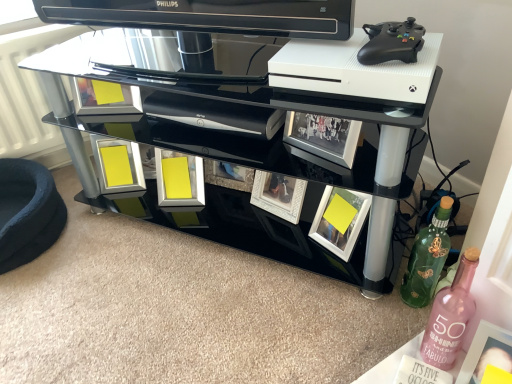
This screenshot has width=512, height=384. What are the coordinates of `pink glass bottle at lower right, the 1th bottle when ordered from front to back` in the screenshot? It's located at (450, 315).

At what (x,y) coordinates should I click in order to perform the action: click on metallic yellow picture frame at lower left, which ranks as the 1th picture frame in back-to-front order. Please return your answer as a coordinate pair (x, y). The width and height of the screenshot is (512, 384). Looking at the image, I should click on (118, 165).

In order to face yellow matte picture frame at lower right, marked as the 1th picture frame in a right-to-left arrangement, should I rotate leftwards or rightwards?

You should rotate right by 30.570 degrees.

Image resolution: width=512 pixels, height=384 pixels. Describe the element at coordinates (426, 257) in the screenshot. I see `green matte bottle at lower right, acting as the second bottle starting from the front` at that location.

What is the approximate height of green matte bottle at lower right, the first bottle viewed from the back?

green matte bottle at lower right, the first bottle viewed from the back, is 12.45 inches tall.

What is the approximate height of velvet cushion at lower left?

velvet cushion at lower left is 7.46 inches tall.

Locate an element on the screen. black glass tv stand at center is located at coordinates (277, 107).

Measure the distance between point (412, 372) and camera.

Point (412, 372) and camera are 84.80 centimeters apart.

Where is `pink glass bottle at lower right, which is counted as the second bottle, starting from the back`? pink glass bottle at lower right, which is counted as the second bottle, starting from the back is located at coordinates (450, 315).

Is point (439, 48) positioned after point (132, 154)?

No, (439, 48) is in front of (132, 154).

Could you tell me if black glass tv stand at center is turned towards metallic yellow picture frame at lower left, which appears as the 5th picture frame when viewed from the front?

Yes, black glass tv stand at center is aimed at metallic yellow picture frame at lower left, which appears as the 5th picture frame when viewed from the front.

Considering the sizes of black glass tv stand at center and metallic yellow picture frame at lower left, which ranks as the 1th picture frame in back-to-front order, in the image, is black glass tv stand at center taller or shorter than metallic yellow picture frame at lower left, which ranks as the 1th picture frame in back-to-front order,?

In the image, black glass tv stand at center appears to be taller than metallic yellow picture frame at lower left, which ranks as the 1th picture frame in back-to-front order.

In terms of height, does white glossy magazine at lower right look taller or shorter compared to metallic silver picture frame at center, the second picture frame in the left-to-right sequence?

Considering their sizes, white glossy magazine at lower right has less height than metallic silver picture frame at center, the second picture frame in the left-to-right sequence.

Is white glossy magazine at lower right at the left side of metallic silver picture frame at center, positioned as the third picture frame in front-to-back order?

No, white glossy magazine at lower right is not to the left of metallic silver picture frame at center, positioned as the third picture frame in front-to-back order.

From a real-world perspective, between white glossy magazine at lower right and metallic silver picture frame at center, the second picture frame in the left-to-right sequence, who is vertically higher?

From a 3D spatial view, metallic silver picture frame at center, the second picture frame in the left-to-right sequence, is above.

Is white glossy magazine at lower right aimed at metallic silver picture frame at center, which is counted as the third picture frame, starting from the back?

No, white glossy magazine at lower right is not facing towards metallic silver picture frame at center, which is counted as the third picture frame, starting from the back.

From the image's perspective, relative to metallic yellow picture frame at lower left, positioned as the 1th picture frame in left-to-right order, is green matte bottle at lower right, acting as the second bottle starting from the front, above or below?

Answer: Based on their image positions, green matte bottle at lower right, acting as the second bottle starting from the front, is located beneath metallic yellow picture frame at lower left, positioned as the 1th picture frame in left-to-right order.

Is point (418, 303) less distant than point (93, 150)?

Yes, point (418, 303) is closer to viewer.

How much distance is there between green matte bottle at lower right, acting as the second bottle starting from the front, and metallic yellow picture frame at lower left, which is counted as the 5th picture frame, starting from the right?

green matte bottle at lower right, acting as the second bottle starting from the front, and metallic yellow picture frame at lower left, which is counted as the 5th picture frame, starting from the right, are 35.11 inches apart from each other.

From a real-world perspective, relative to metallic yellow picture frame at lower left, which appears as the 5th picture frame when viewed from the front, is green matte bottle at lower right, the first bottle viewed from the back, vertically above or below?

green matte bottle at lower right, the first bottle viewed from the back, is situated higher than metallic yellow picture frame at lower left, which appears as the 5th picture frame when viewed from the front, in the real world.

Based on the photo, considering the sizes of matte yellow picture frame at lower center, acting as the 3th picture frame starting from the left, and green matte bottle at lower right, the first bottle viewed from the back, in the image, is matte yellow picture frame at lower center, acting as the 3th picture frame starting from the left, taller or shorter than green matte bottle at lower right, the first bottle viewed from the back,?

matte yellow picture frame at lower center, acting as the 3th picture frame starting from the left, is shorter than green matte bottle at lower right, the first bottle viewed from the back.

From the image's perspective, is matte yellow picture frame at lower center, positioned as the 2th picture frame in back-to-front order, positioned above or below green matte bottle at lower right, the first bottle viewed from the back?

From the image's perspective, matte yellow picture frame at lower center, positioned as the 2th picture frame in back-to-front order, appears above green matte bottle at lower right, the first bottle viewed from the back.

Is matte yellow picture frame at lower center, acting as the 3th picture frame starting from the right, oriented away from green matte bottle at lower right, the first bottle viewed from the back?

No, matte yellow picture frame at lower center, acting as the 3th picture frame starting from the right, is not facing away from green matte bottle at lower right, the first bottle viewed from the back.

Considering the positions of point (193, 171) and point (472, 250), is point (193, 171) closer or farther from the camera than point (472, 250)?

Point (193, 171).

Is the position of matte yellow picture frame at lower center, acting as the 3th picture frame starting from the right, more distant than that of pink glass bottle at lower right, which is counted as the second bottle, starting from the back?

Yes, the depth of matte yellow picture frame at lower center, acting as the 3th picture frame starting from the right, is greater than that of pink glass bottle at lower right, which is counted as the second bottle, starting from the back.

Is the surface of matte yellow picture frame at lower center, positioned as the 2th picture frame in back-to-front order, in direct contact with pink glass bottle at lower right, the 1th bottle when ordered from front to back?

No.

Consider the image. Is matte yellow picture frame at lower center, acting as the 3th picture frame starting from the right, facing away from black glass tv stand at center?

Absolutely, matte yellow picture frame at lower center, acting as the 3th picture frame starting from the right, is directed away from black glass tv stand at center.

Does matte yellow picture frame at lower center, positioned as the 2th picture frame in back-to-front order, have a smaller size compared to black glass tv stand at center?

Yes.

Which is behind, matte yellow picture frame at lower center, the 4th picture frame positioned from the front, or black glass tv stand at center?

matte yellow picture frame at lower center, the 4th picture frame positioned from the front, is more distant.

Is matte yellow picture frame at lower center, the 4th picture frame positioned from the front, spatially inside black glass tv stand at center, or outside of it?

matte yellow picture frame at lower center, the 4th picture frame positioned from the front, fits inside black glass tv stand at center.

How different are the orientations of black glass tv stand at center and matte yellow picture frame at lower center, positioned as the 2th picture frame in back-to-front order, in degrees?

22.7 degrees.

From a real-world perspective, does black glass tv stand at center sit lower than matte yellow picture frame at lower center, acting as the 3th picture frame starting from the right?

No, from a real-world perspective, black glass tv stand at center is not beneath matte yellow picture frame at lower center, acting as the 3th picture frame starting from the right.

In terms of width, does black glass tv stand at center look wider or thinner when compared to matte yellow picture frame at lower center, positioned as the 2th picture frame in back-to-front order?

Considering their sizes, black glass tv stand at center looks broader than matte yellow picture frame at lower center, positioned as the 2th picture frame in back-to-front order.

From the image's perspective, between black glass tv stand at center and matte yellow picture frame at lower center, acting as the 3th picture frame starting from the left, which one is located above?

black glass tv stand at center, from the image's perspective.

What are the coordinates of `the 3rd picture frame to the left of the black glass tv stand at center, starting your count from the anchor` in the screenshot? It's located at (118, 165).

Where is `magazine located in front of the metallic silver picture frame at center, positioned as the third picture frame in front-to-back order`? The height and width of the screenshot is (384, 512). magazine located in front of the metallic silver picture frame at center, positioned as the third picture frame in front-to-back order is located at coordinates (420, 373).

Looking at the image, which one is located closer to metallic yellow picture frame at lower left, which ranks as the 1th picture frame in back-to-front order, metallic silver picture frame at center, which is the 4th picture frame from right to left, or matte yellow picture frame at lower center, acting as the 3th picture frame starting from the left?

Among the two, matte yellow picture frame at lower center, acting as the 3th picture frame starting from the left, is located nearer to metallic yellow picture frame at lower left, which ranks as the 1th picture frame in back-to-front order.

Consider the image. Considering their positions, is black glass tv stand at center positioned closer to yellow matte picture frame at lower right, arranged as the 4th picture frame when viewed from the left, than pink glass bottle at lower right, the 1th bottle when ordered from front to back?

pink glass bottle at lower right, the 1th bottle when ordered from front to back, is positioned closer to the anchor yellow matte picture frame at lower right, arranged as the 4th picture frame when viewed from the left.

Considering their positions, is yellow matte picture frame at lower right, which ranks as the second picture frame in front-to-back order, positioned further to matte yellow picture frame at lower center, the 4th picture frame positioned from the front, than green matte bottle at lower right, the first bottle viewed from the back?

green matte bottle at lower right, the first bottle viewed from the back, lies further to matte yellow picture frame at lower center, the 4th picture frame positioned from the front, than the other object.

From the image, which object appears to be farther from pink glass bottle at lower right, which is counted as the second bottle, starting from the back, yellow matte picture frame at lower right, which ranks as the second picture frame in front-to-back order, or metallic silver picture frame at center, positioned as the third picture frame in front-to-back order?

The object further to pink glass bottle at lower right, which is counted as the second bottle, starting from the back, is metallic silver picture frame at center, positioned as the third picture frame in front-to-back order.

Looking at this image, considering their positions, is yellow matte picture frame at lower right, acting as the 5th picture frame starting from the back, positioned closer to metallic yellow picture frame at lower left, which ranks as the 1th picture frame in back-to-front order, than yellow matte picture frame at lower right, arranged as the 4th picture frame when viewed from the left?

The object closer to metallic yellow picture frame at lower left, which ranks as the 1th picture frame in back-to-front order, is yellow matte picture frame at lower right, arranged as the 4th picture frame when viewed from the left.

Based on their spatial positions, is yellow matte picture frame at lower right, acting as the 5th picture frame starting from the back, or pink glass bottle at lower right, the 1th bottle when ordered from front to back, closer to black glass tv stand at center?

Based on the image, pink glass bottle at lower right, the 1th bottle when ordered from front to back, appears to be nearer to black glass tv stand at center.

Considering their positions, is matte yellow picture frame at lower center, the 4th picture frame positioned from the front, positioned further to velvet cushion at lower left than green matte bottle at lower right, the first bottle viewed from the back?

Based on the image, green matte bottle at lower right, the first bottle viewed from the back, appears to be further to velvet cushion at lower left.

When comparing their distances from matte yellow picture frame at lower center, acting as the 3th picture frame starting from the right, does metallic yellow picture frame at lower left, which is counted as the 5th picture frame, starting from the right, or pink glass bottle at lower right, the 1th bottle when ordered from front to back, seem closer?

metallic yellow picture frame at lower left, which is counted as the 5th picture frame, starting from the right, is positioned closer to the anchor matte yellow picture frame at lower center, acting as the 3th picture frame starting from the right.

Locate an element on the screen. bottle between black glass tv stand at center and green matte bottle at lower right, acting as the second bottle starting from the front is located at coordinates (450, 315).

The image size is (512, 384). In order to click on picture frame between pink glass bottle at lower right, which is counted as the second bottle, starting from the back, and white glossy magazine at lower right from top to bottom in this screenshot , I will do `click(486, 353)`.

What are the coordinates of `picture frame between metallic silver picture frame at center, which is the 4th picture frame from right to left, and matte yellow picture frame at lower center, acting as the 3th picture frame starting from the left, in the up-down direction` in the screenshot? It's located at (118, 165).

Locate an element on the screen. This screenshot has height=384, width=512. table between metallic silver picture frame at center, positioned as the third picture frame in front-to-back order, and yellow matte picture frame at lower right, which appears as the 5th picture frame when viewed from the left is located at coordinates (277, 107).